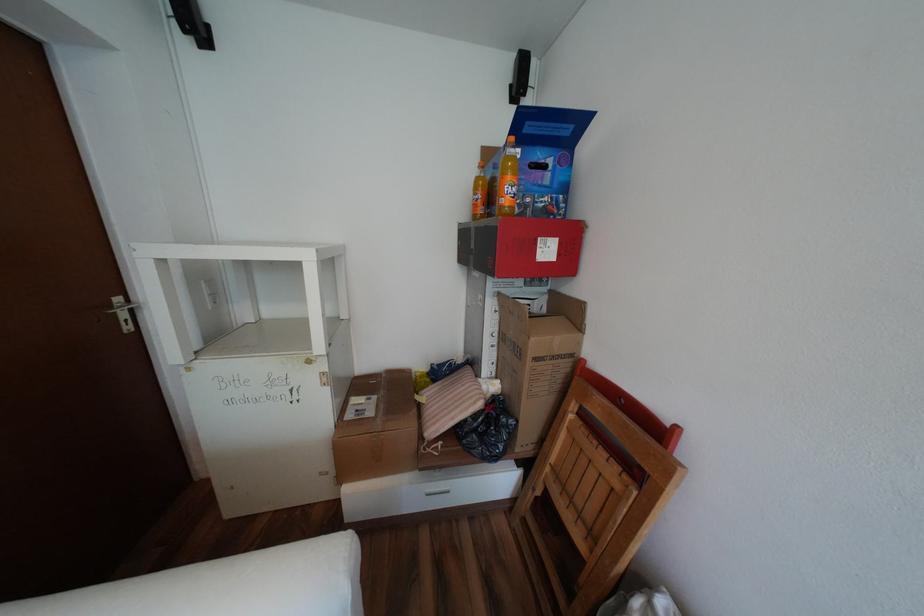
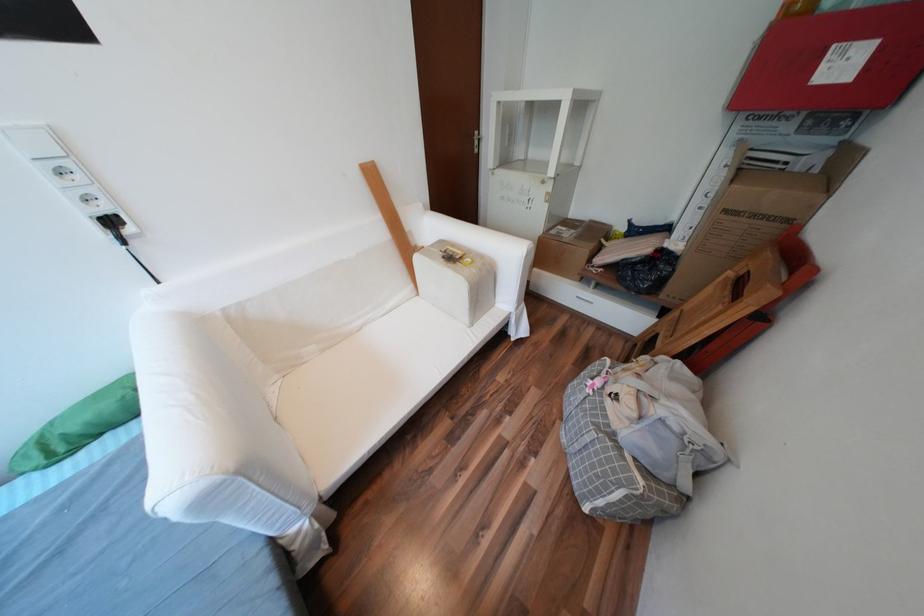
Locate, in the second image, the point that corresponds to (544,359) in the first image.

(736, 211)